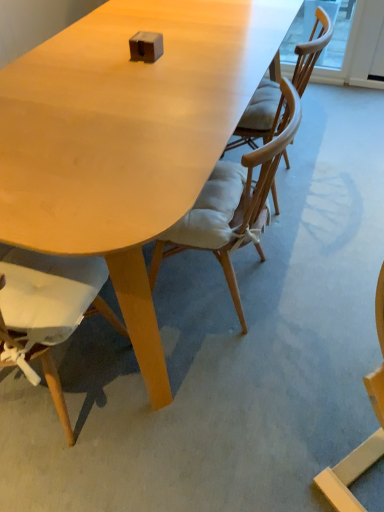
The width and height of the screenshot is (384, 512). I want to click on free spot below light brown wood chair at center, which is counted as the second chair, starting from the left (from a real-world perspective), so click(x=200, y=285).